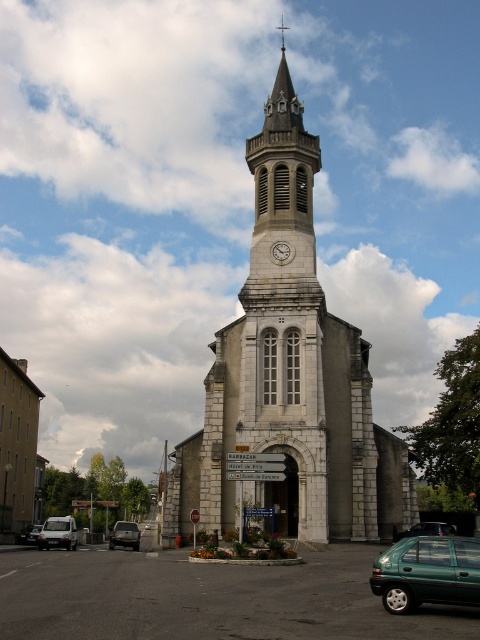
Question: Among these objects, which one is nearest to the camera?

Choices:
 (A) green matte car at center
 (B) metallic gray sedan at lower left
 (C) matte black van at lower left
 (D) white stone clock tower at center

Answer: (D)

Question: Which object appears farthest from the camera in this image?

Choices:
 (A) white stone clock at center
 (B) metallic gray sedan at lower left
 (C) green matte car at center

Answer: (B)

Question: Can you confirm if white stone clock tower at center is thinner than white stone clock at center?

Choices:
 (A) yes
 (B) no

Answer: (B)

Question: Is metallic gray sedan at lower left thinner than white stone clock at center?

Choices:
 (A) no
 (B) yes

Answer: (A)

Question: Estimate the real-world distances between objects in this image. Which object is farther from the metallic gray sedan at lower left?

Choices:
 (A) white stone clock tower at center
 (B) white stone clock at center
 (C) matte black van at lower left

Answer: (B)

Question: Observing the image, what is the correct spatial positioning of white matte van at lower left in reference to green matte car at center?

Choices:
 (A) above
 (B) below

Answer: (B)